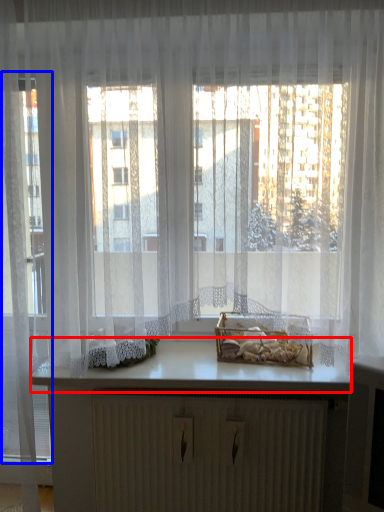
Question: Among these objects, which one is nearest to the camera, counter top (highlighted by a red box) or glass door (highlighted by a blue box)?

Choices:
 (A) counter top
 (B) glass door

Answer: (B)